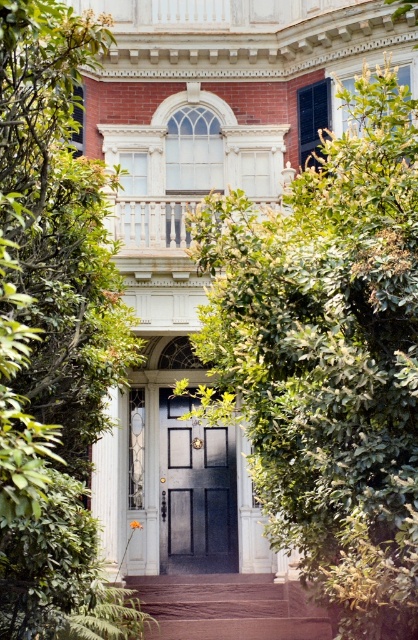
You are a delivery person carrying a heavy package and need to reach the matte black door at center. The brown stone stairs at center are in your way. Can you walk around the stairs to reach the door without climbing them?

The matte black door at center and brown stone stairs at center are 7.73 meters apart from each other. Since the distance between them is quite large, you can easily walk around the stairs to reach the door without needing to climb them.

You are standing at the entrance of the historic house and want to take a photo. There are two points marked in the scene. The first point is at coordinate point (196, 563) and the second point is at coordinate point (300, 621). Which point is closer to your camera when taking the photo?

Point (196, 563) is further to the camera than point (300, 621), so the second point is closer to the camera.

You are planning to place a new bench in the entrance area of the historic house. The bench is 1.2 meters wide. Based on the image, can the bench fit between the green leafy bush at center and the brown stone stairs at center?

The green leafy bush at center is narrower than the brown stone stairs at center. However, the exact distance between them isn not provided. Therefore, it is uncertain whether the bench will fit without more information about the space between the two objects.